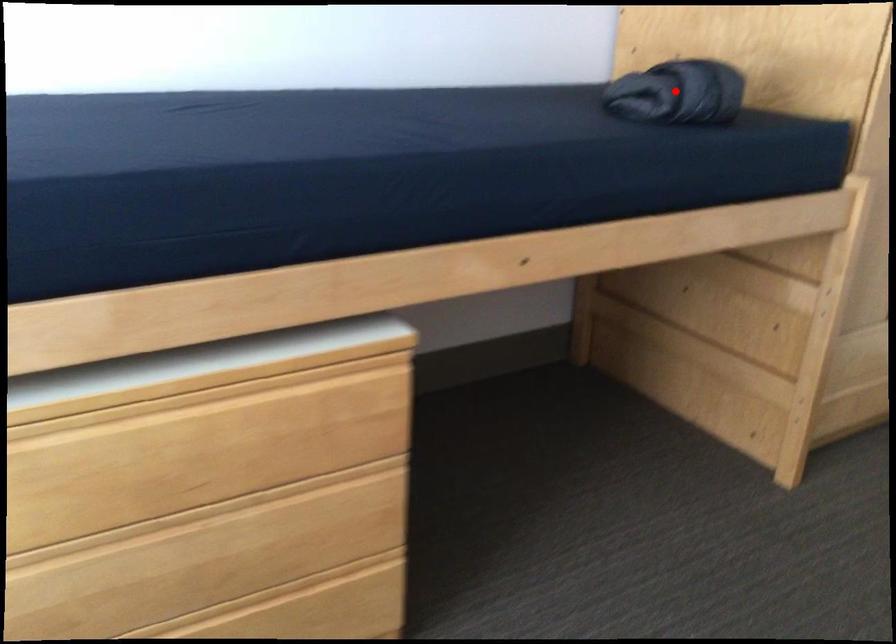
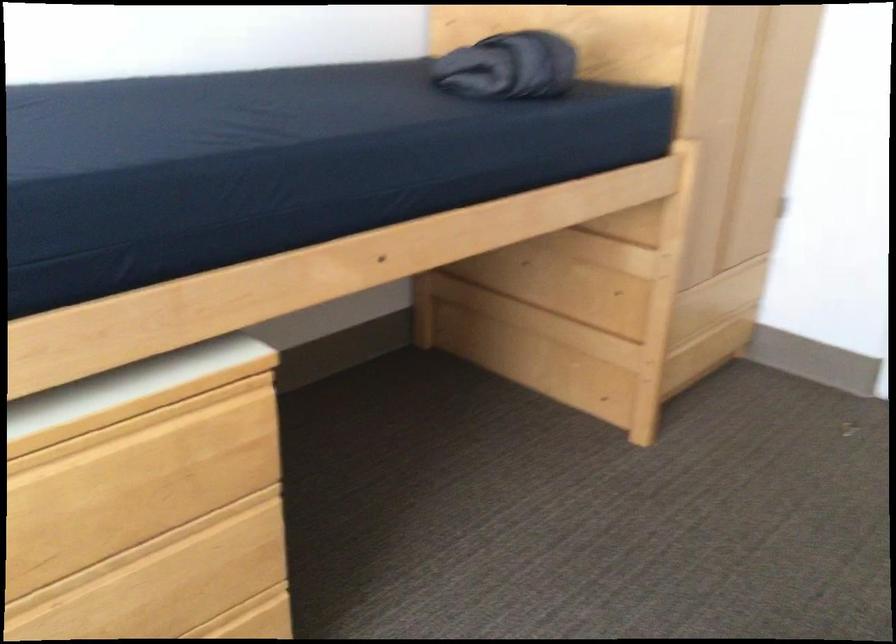
In the second image, find the point that corresponds to the highlighted location in the first image.

(509, 67)